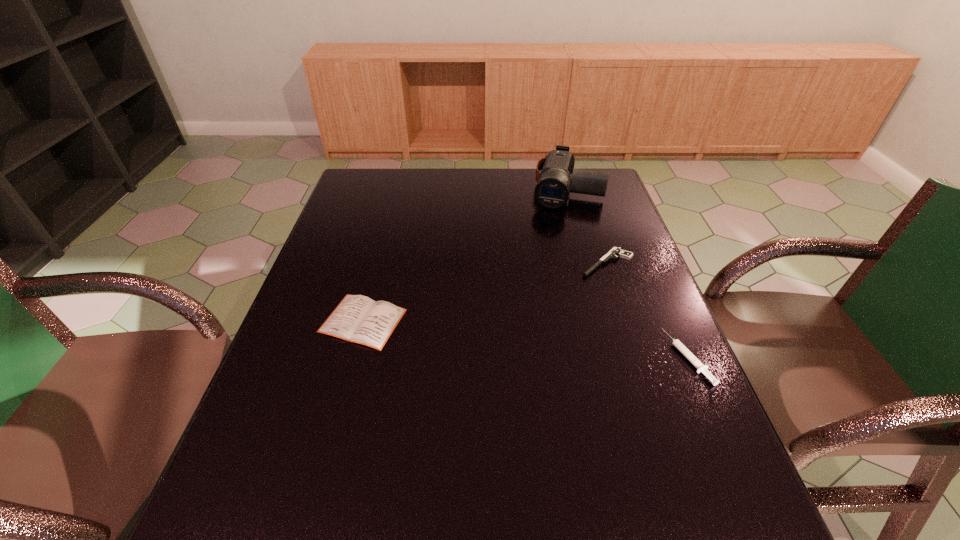
Find the location of a particular element. free space at the far edge of the desktop is located at coordinates (501, 179).

In the image, there is a desktop. Identify the location of free space at the near edge. This screenshot has width=960, height=540. (378, 468).

Find the location of a particular element. vacant space at the left edge is located at coordinates (335, 243).

This screenshot has width=960, height=540. Find the location of `vacant area at the right edge`. vacant area at the right edge is located at coordinates (585, 222).

Locate an element on the screen. vacant space at the far left corner is located at coordinates (364, 190).

Locate an element on the screen. The height and width of the screenshot is (540, 960). blank region between the diary and the pistol is located at coordinates [x=485, y=292].

Find the location of `free spot between the pistol and the syringe`. free spot between the pistol and the syringe is located at coordinates (647, 310).

Locate an element on the screen. This screenshot has width=960, height=540. free spot between the camcorder and the syringe is located at coordinates (627, 273).

Where is `vacant region between the syringe and the camcorder`? The width and height of the screenshot is (960, 540). vacant region between the syringe and the camcorder is located at coordinates (627, 273).

The height and width of the screenshot is (540, 960). In order to click on vacant point located between the syringe and the camcorder in this screenshot , I will do `click(627, 273)`.